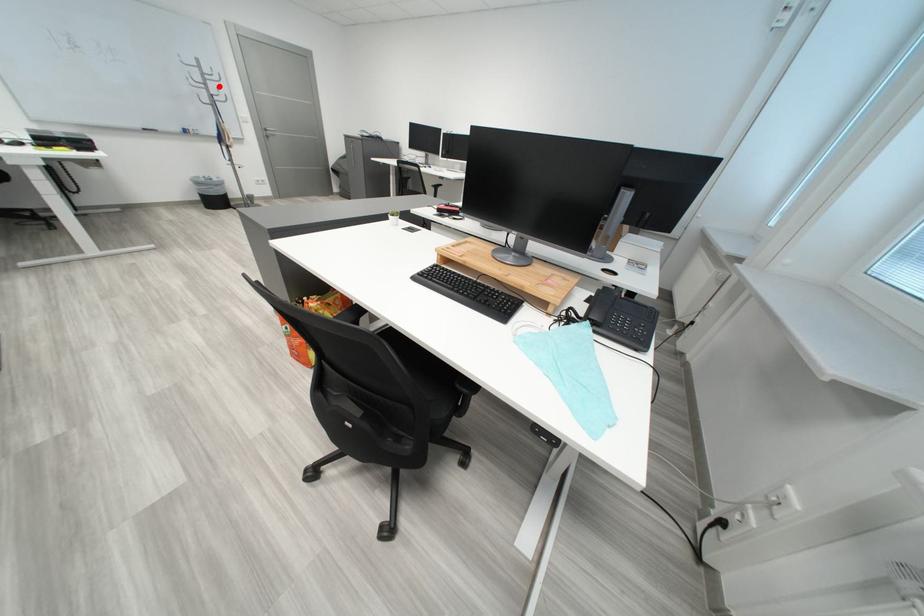
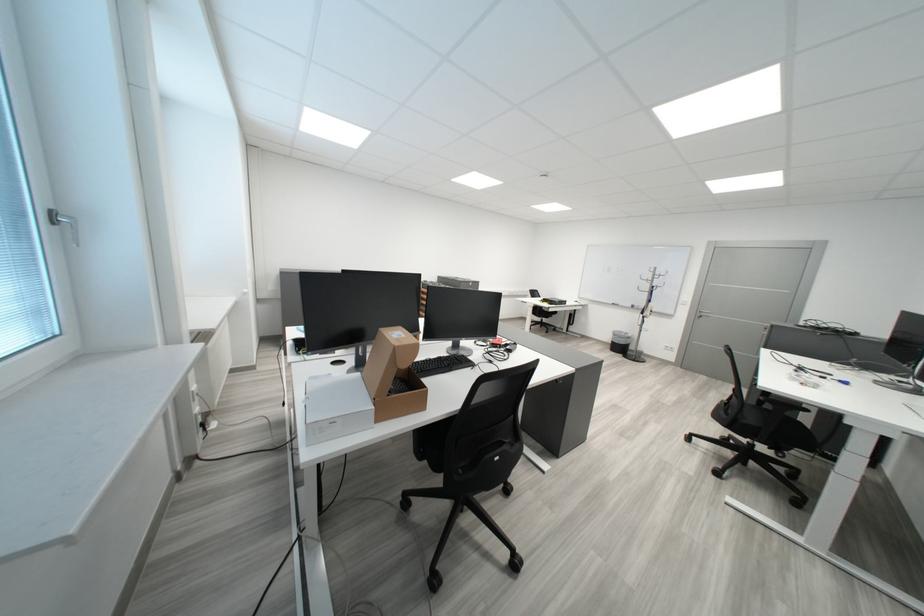
Question: A red point is marked in image1. In image2, is the corresponding 3D point closer to the camera or farther? Reply with the corresponding letter.

Choices:
 (A) The corresponding 3D point is closer.
 (B) The corresponding 3D point is farther.

Answer: (A)